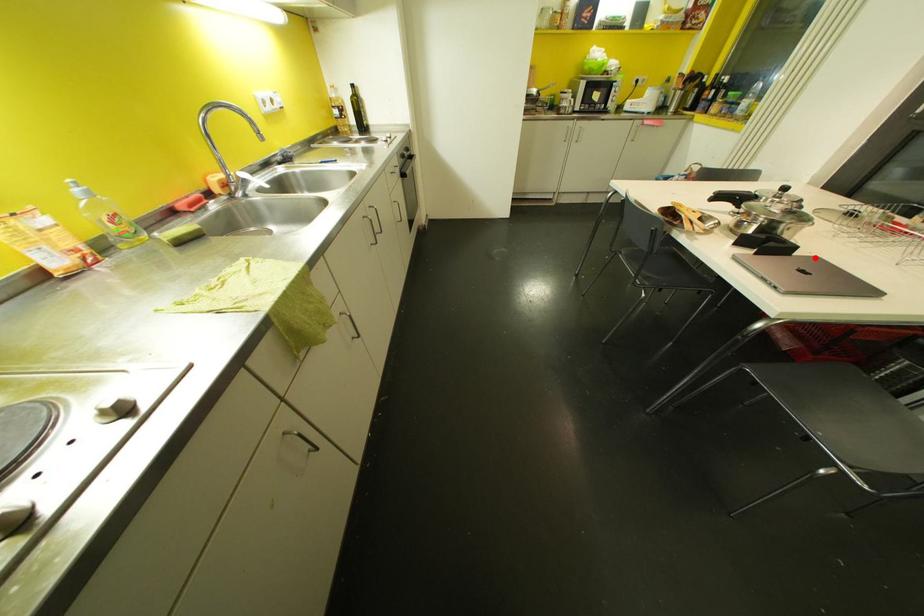
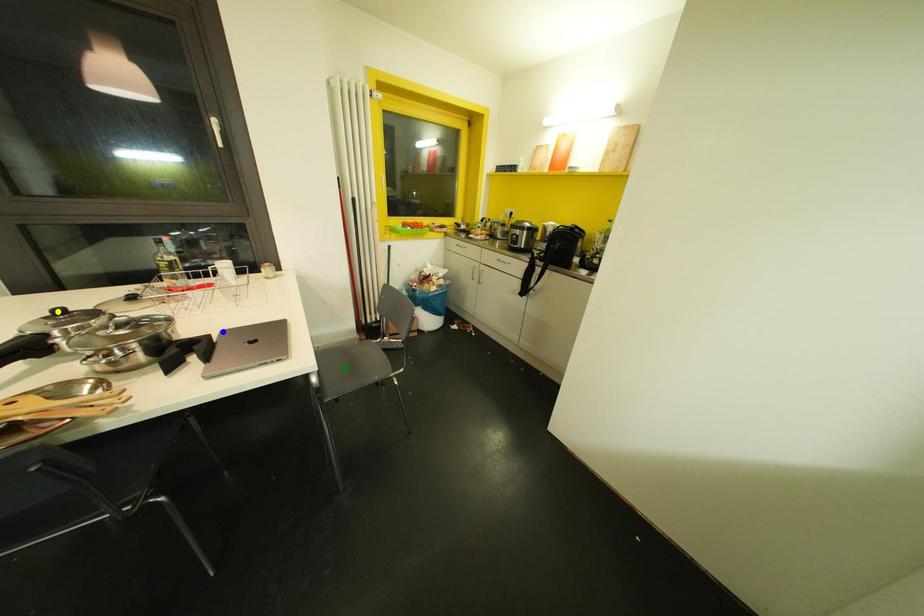
Question: I am providing you with two images of the same scene from different viewpoints. A red point is marked on the first image. You are given multiple points on the second image. Which spot in image 2 lines up with the point in image 1?

Choices:
 (A) blue point
 (B) green point
 (C) yellow point

Answer: (A)